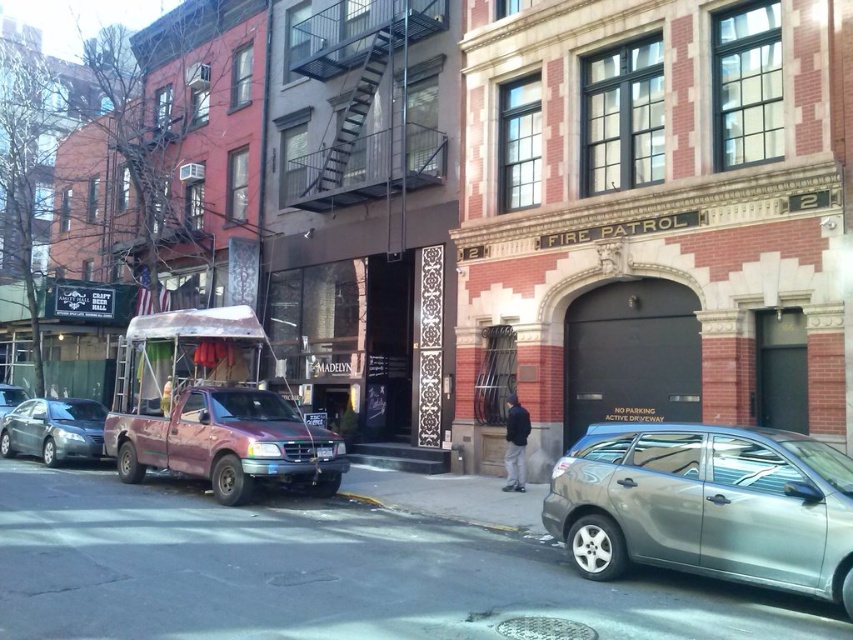
Question: Observing the image, what is the correct spatial positioning of dark gray jacket at center in reference to yellow rubber at lower center?

Choices:
 (A) left
 (B) right

Answer: (B)

Question: Is yellow rubber at lower center above silver metallic sedan at center?

Choices:
 (A) yes
 (B) no

Answer: (B)

Question: Which is farther from the silver metallic car at center?

Choices:
 (A) yellow rubber at lower center
 (B) silver metallic sedan at center
 (C) rusty metal food truck at left

Answer: (B)

Question: Among these points, which one is nearest to the camera?

Choices:
 (A) (12, 422)
 (B) (523, 531)
 (C) (560, 531)
 (D) (506, 413)

Answer: (C)

Question: Can you confirm if matte gray sedan at left is positioned above yellow rubber at lower center?

Choices:
 (A) yes
 (B) no

Answer: (A)

Question: Estimate the real-world distances between objects in this image. Which object is farther from the rusty metal food truck at left?

Choices:
 (A) dark gray jacket at center
 (B) silver metallic sedan at center
 (C) matte gray sedan at left

Answer: (B)